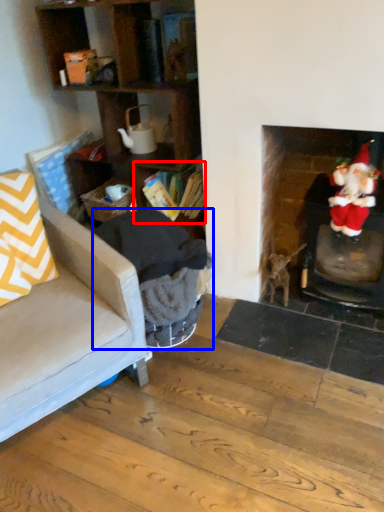
Question: Which point is further to the camera, shelf (highlighted by a red box) or rocking chair (highlighted by a blue box)?

Choices:
 (A) shelf
 (B) rocking chair

Answer: (A)